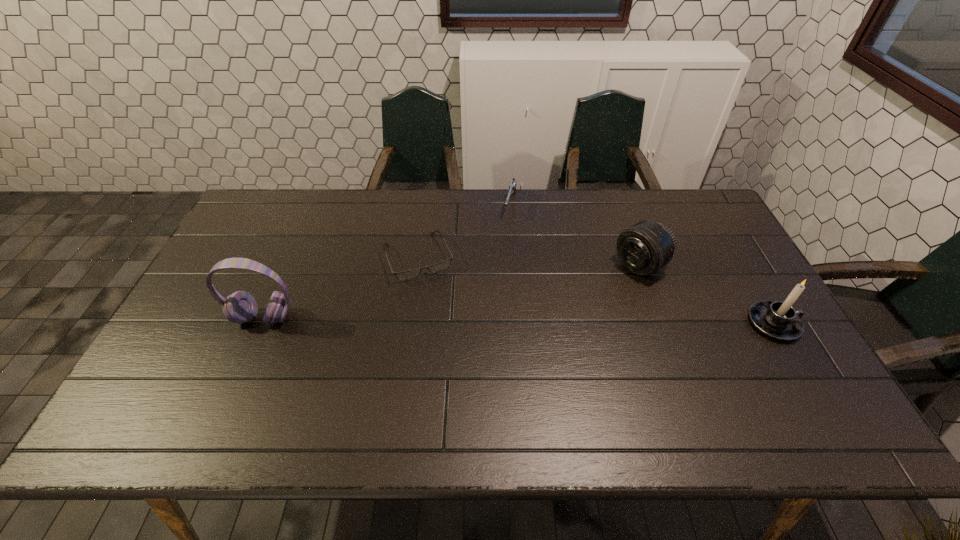
What are the coordinates of `the tallest object` in the screenshot? It's located at (240, 307).

Identify the location of the leftmost object. This screenshot has height=540, width=960. (240, 307).

Locate an element on the screen. candle holder is located at coordinates (779, 320).

The height and width of the screenshot is (540, 960). What are the coordinates of `the fourth object from right to left` in the screenshot? It's located at (409, 274).

Image resolution: width=960 pixels, height=540 pixels. I want to click on the shortest object, so click(x=409, y=274).

Image resolution: width=960 pixels, height=540 pixels. In order to click on the second object from right to left in this screenshot , I will do `click(644, 248)`.

Where is `telephoto lens`? telephoto lens is located at coordinates pos(644,248).

The width and height of the screenshot is (960, 540). What are the coordinates of `the farthest object` in the screenshot? It's located at (512, 187).

The height and width of the screenshot is (540, 960). In order to click on the second shortest object in this screenshot , I will do `click(512, 187)`.

Image resolution: width=960 pixels, height=540 pixels. I want to click on vacant space situated on the headband and ear cups of the headset, so click(251, 350).